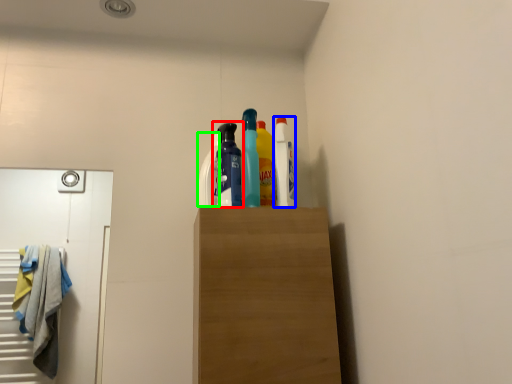
Question: Which object is the closest to the bottle (highlighted by a red box)? Choose among these: cleaning product (highlighted by a blue box) or cleaning product (highlighted by a green box).

Choices:
 (A) cleaning product
 (B) cleaning product

Answer: (B)